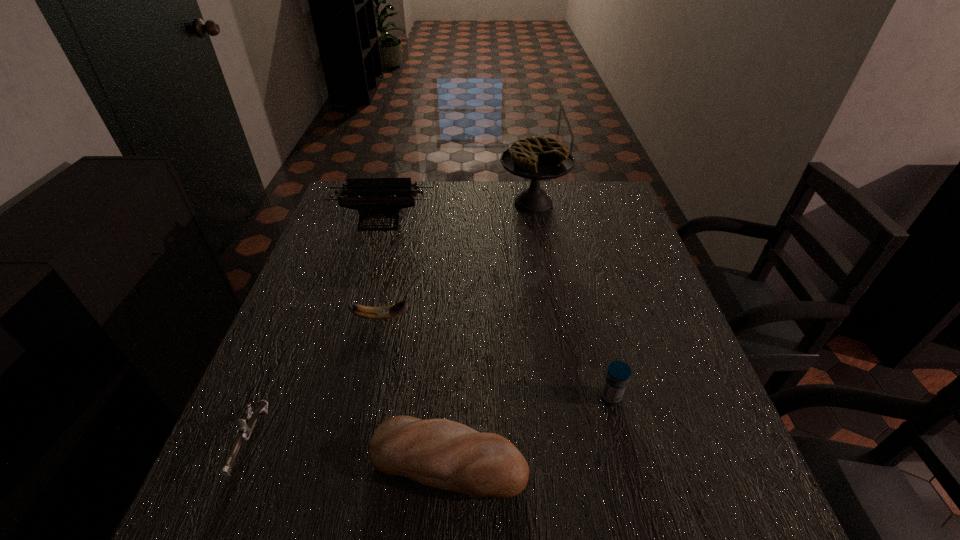
Image resolution: width=960 pixels, height=540 pixels. I want to click on vacant point located between the bread and the fifth shortest object, so click(x=415, y=340).

At what (x,y) coordinates should I click in order to perform the action: click on free space between the fourth nearest object and the pie. Please return your answer as a coordinate pair (x, y). Looking at the image, I should click on (457, 260).

I want to click on empty space that is in between the gun and the fifth shortest object, so click(317, 331).

Choose which object is the fifth nearest neighbor to the medicine. Please provide its 2D coordinates. Your answer should be formatted as a tuple, i.e. [(x, y)], where the tuple contains the x and y coordinates of a point satisfying the conditions above.

[(374, 198)]

Point out which object is positioned as the fifth nearest to the typewriter. Please provide its 2D coordinates. Your answer should be formatted as a tuple, i.e. [(x, y)], where the tuple contains the x and y coordinates of a point satisfying the conditions above.

[(618, 373)]

Locate an element on the screen. vacant space that satisfies the following two spatial constraints: 1. on the peel of the banana; 2. aimed along the barrel of the gun is located at coordinates (353, 442).

The height and width of the screenshot is (540, 960). I want to click on free spot that satisfies the following two spatial constraints: 1. on the peel of the fourth nearest object; 2. aimed along the barrel of the gun, so click(353, 442).

I want to click on vacant space that satisfies the following two spatial constraints: 1. on the peel of the bread; 2. on the right side of the fourth nearest object, so click(x=349, y=459).

In order to click on free region that satisfies the following two spatial constraints: 1. on the cut side of the tallest object; 2. on the left side of the medicine in this screenshot , I will do `click(565, 397)`.

Where is `vacant space that satisfies the following two spatial constraints: 1. aimed along the barrel of the gun; 2. on the right side of the bread`? The height and width of the screenshot is (540, 960). vacant space that satisfies the following two spatial constraints: 1. aimed along the barrel of the gun; 2. on the right side of the bread is located at coordinates (245, 459).